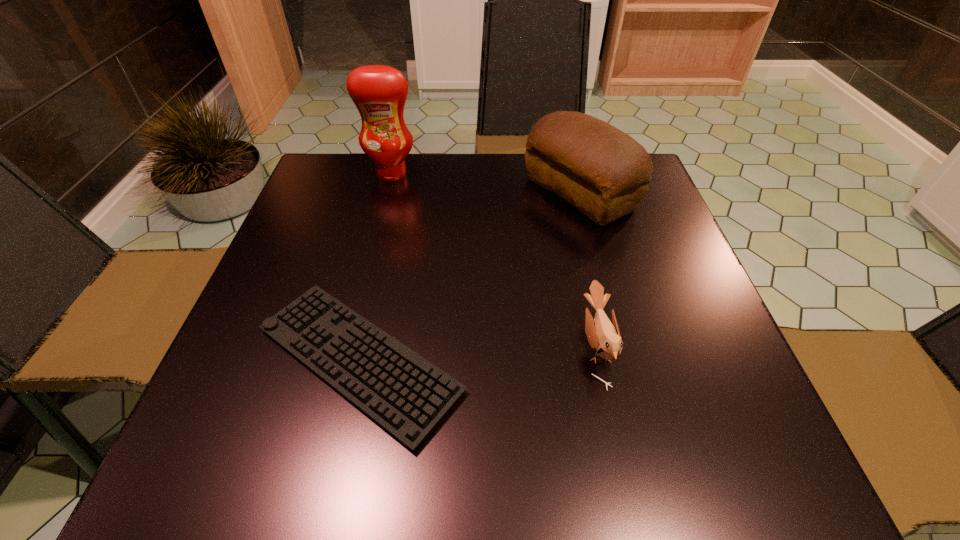
Find the location of `condiment`. condiment is located at coordinates (379, 92).

Where is `the second tallest object`? The height and width of the screenshot is (540, 960). the second tallest object is located at coordinates pyautogui.click(x=603, y=172).

At what (x,y) coordinates should I click in order to perform the action: click on the third tallest object. Please return your answer as a coordinate pair (x, y). The width and height of the screenshot is (960, 540). Looking at the image, I should click on (603, 336).

The height and width of the screenshot is (540, 960). Find the location of `the shortest object`. the shortest object is located at coordinates (407, 395).

Identify the location of free space located on the label side of the tallest object. This screenshot has width=960, height=540. (363, 287).

Locate an element on the screen. The height and width of the screenshot is (540, 960). vacant region located 0.130m on the left of the bread is located at coordinates (473, 193).

I want to click on vacant space located at the beak of the bird, so tap(371, 345).

I want to click on vacant space located 0.070m at the beak of the bird, so click(542, 345).

This screenshot has height=540, width=960. Identify the location of vacant space located at the beak of the bird. (375, 345).

Identify the location of free space located 0.050m on the right of the shortest object. The height and width of the screenshot is (540, 960). (496, 360).